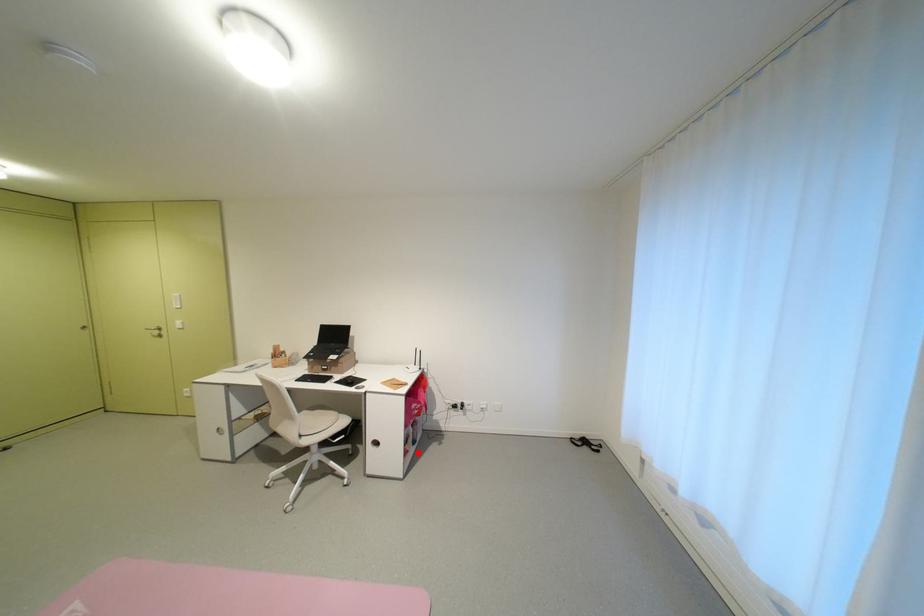
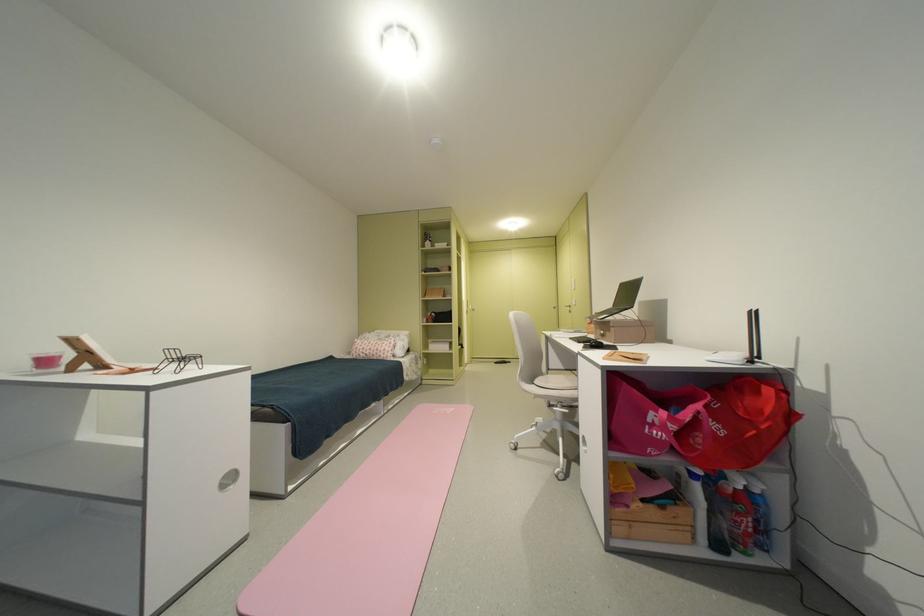
The point at the highlighted location is marked in the first image. Where is the corresponding point in the second image?

(638, 508)